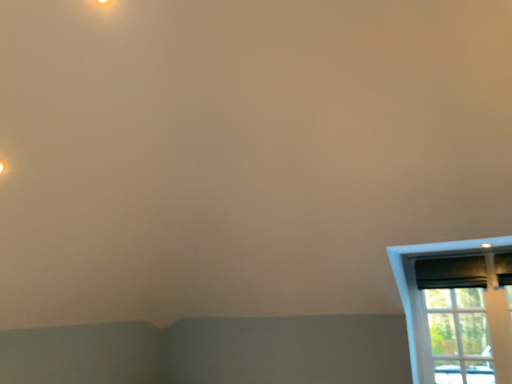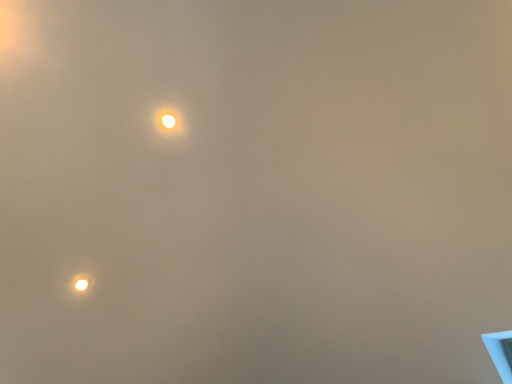
Question: How did the camera likely rotate when shooting the video?

Choices:
 (A) rotated left
 (B) rotated right

Answer: (A)